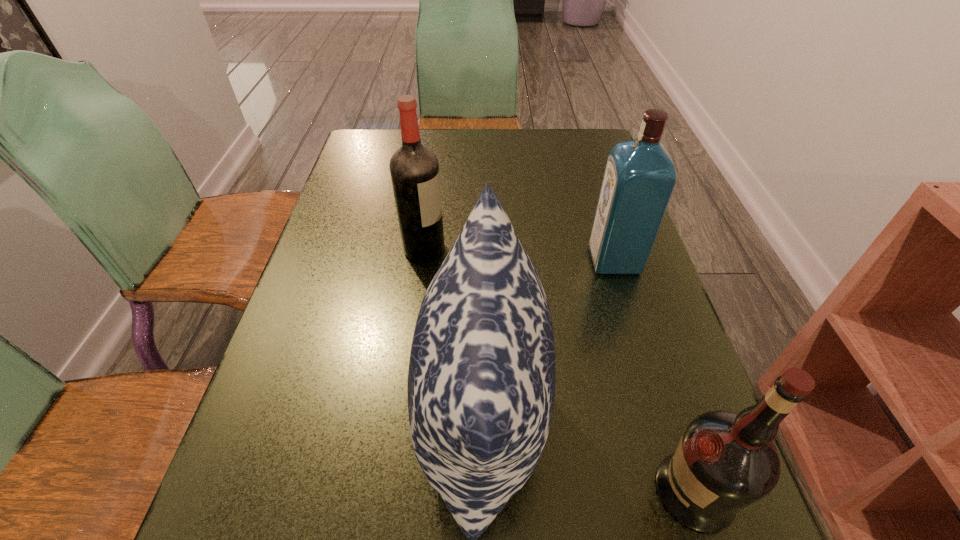
Where is `the leftmost liquor`? The image size is (960, 540). the leftmost liquor is located at coordinates coord(414,168).

Locate an element on the screen. The width and height of the screenshot is (960, 540). the nearest liquor is located at coordinates (725, 461).

You are a GUI agent. You are given a task and a screenshot of the screen. Output one action in this format:
    pyautogui.click(x=<x>, y=<y>)
    Task: Click on the free space located 0.100m on the front-facing side of the leftmost liquor
    The width and height of the screenshot is (960, 540).
    Given the screenshot: What is the action you would take?
    pyautogui.click(x=487, y=249)

At what (x,y) coordinates should I click in order to perform the action: click on free location located on the surface of the nearest liquor. Please return your answer as a coordinate pair (x, y). Looking at the image, I should click on (462, 491).

This screenshot has width=960, height=540. I want to click on vacant space situated on the surface of the nearest liquor, so click(x=494, y=491).

You are a GUI agent. You are given a task and a screenshot of the screen. Output one action in this format:
    pyautogui.click(x=<x>, y=<y>)
    Task: Click on the free location located 0.120m on the surface of the nearest liquor
    This screenshot has height=540, width=960.
    Given the screenshot: What is the action you would take?
    pyautogui.click(x=579, y=491)

The width and height of the screenshot is (960, 540). Find the location of `vacant region at the far edge of the desktop`. vacant region at the far edge of the desktop is located at coordinates (444, 141).

The image size is (960, 540). What are the coordinates of `free space at the left edge of the desktop` in the screenshot? It's located at (390, 188).

Locate an element on the screen. This screenshot has width=960, height=540. vacant space at the right edge of the desktop is located at coordinates (599, 346).

Find the location of a particular element. Image resolution: width=960 pixels, height=540 pixels. vacant space at the far left corner of the desktop is located at coordinates (356, 150).